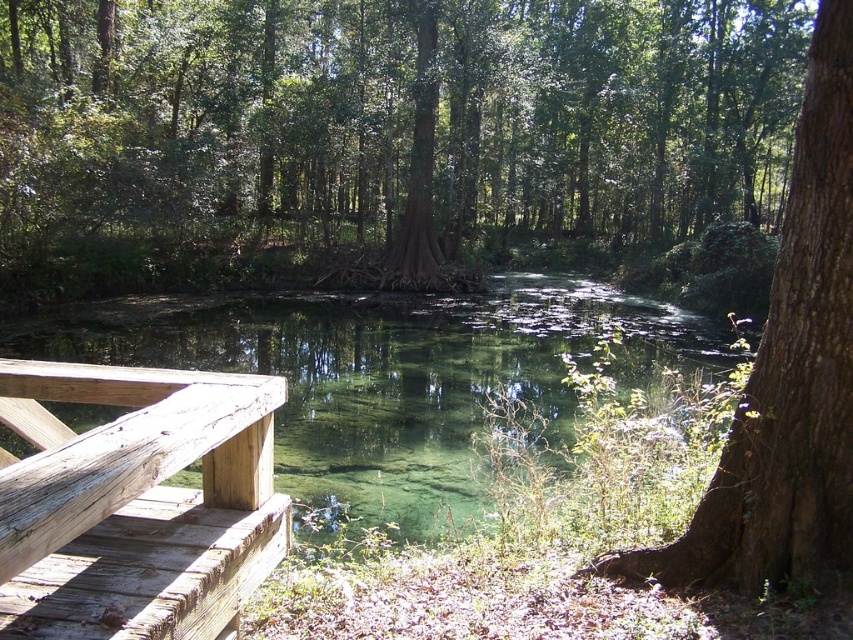
You are standing on the wooden dock and want to cross to the other side of the clear water stream at center. Based on the coordinates provided, is the stream directly in front of you or to one side?

The clear water stream at center is located at coordinates point (392,374), which places it directly in front of you since it is at the center of the scene.

You are standing on the wooden dock and want to toss a small pebble to hit both the weathered wood at left and the brown rough bark tree at right. Can you do it in one throw without moving your position?

The weathered wood at left and the brown rough bark tree at right are 8.85 feet apart. Since the distance between them is within a typical pebble throw range, you can likely toss the pebble to hit both targets in one throw without moving your position.